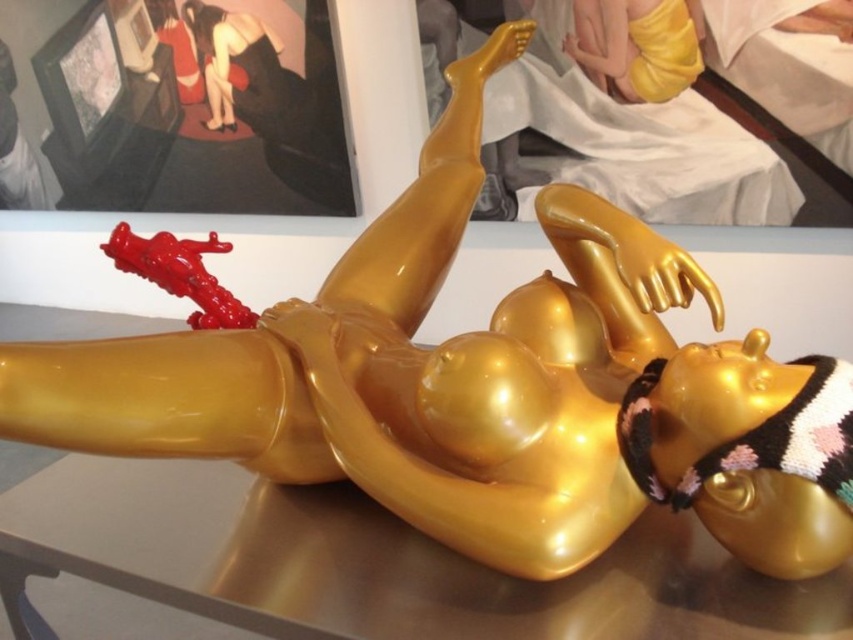
Question: Which point is farther to the camera?

Choices:
 (A) glossy plastic toy at upper left
 (B) transparent glass table at lower center

Answer: (A)

Question: Is transparent glass table at lower center to the left of glossy plastic toy at upper left from the viewer's perspective?

Choices:
 (A) yes
 (B) no

Answer: (B)

Question: Among these objects, which one is farthest from the camera?

Choices:
 (A) glossy plastic toy at upper left
 (B) transparent glass table at lower center

Answer: (A)

Question: Does transparent glass table at lower center appear on the left side of glossy plastic toy at upper left?

Choices:
 (A) no
 (B) yes

Answer: (A)

Question: Which object appears farthest from the camera in this image?

Choices:
 (A) glossy plastic toy at upper left
 (B) transparent glass table at lower center

Answer: (A)

Question: Is transparent glass table at lower center closer to the viewer compared to glossy plastic toy at upper left?

Choices:
 (A) no
 (B) yes

Answer: (B)